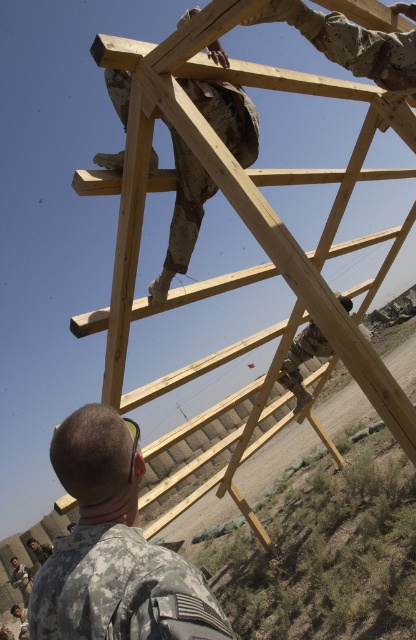
Question: Can you confirm if camouflage fabric uniform at lower left is positioned to the right of camouflage fabric soldier at lower right?

Choices:
 (A) yes
 (B) no

Answer: (B)

Question: Among these points, which one is farthest from the camera?

Choices:
 (A) (346, 300)
 (B) (166, 589)

Answer: (A)

Question: Is camouflage uniform at lower left behind camouflage fabric uniform at lower left?

Choices:
 (A) no
 (B) yes

Answer: (A)

Question: Which point is farther to the camera?

Choices:
 (A) (106, 624)
 (B) (96, 433)

Answer: (B)

Question: Which object is closer to the camera taking this photo?

Choices:
 (A) camouflage fabric uniform at lower left
 (B) light brown wooden ladder at upper center
 (C) camouflage fabric soldier at lower right
 (D) camouflage uniform at lower left

Answer: (D)

Question: Does light brown wooden ladder at upper center appear on the left side of camouflage uniform at lower left?

Choices:
 (A) no
 (B) yes

Answer: (A)